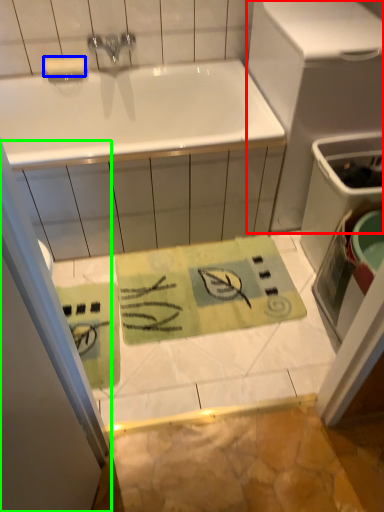
Question: Which object is the closest to the appliance (highlighted by a red box)? Choose among these: soap (highlighted by a blue box) or shower door (highlighted by a green box).

Choices:
 (A) soap
 (B) shower door

Answer: (A)